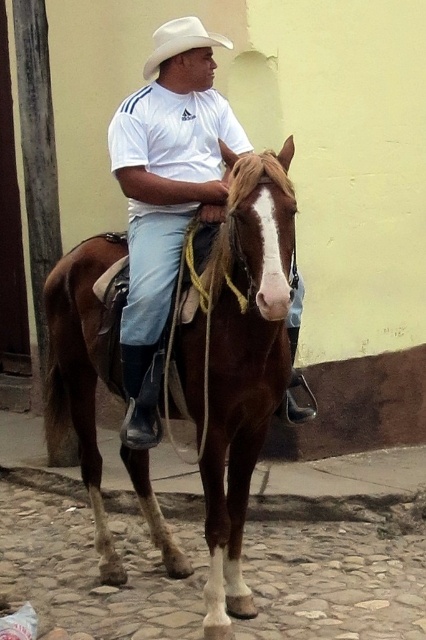
Does brown glossy horse at center have a greater width compared to white matte shirt at center?

Incorrect, brown glossy horse at center's width does not surpass white matte shirt at center's.

You are a GUI agent. You are given a task and a screenshot of the screen. Output one action in this format:
    pyautogui.click(x=<x>, y=<y>)
    Task: Click on the brown glossy horse at center
    
    Given the screenshot: What is the action you would take?
    pyautogui.click(x=238, y=362)

Between point (239, 280) and point (203, 93), which one is positioned behind?

Positioned behind is point (203, 93).

Locate an element on the screen. The height and width of the screenshot is (640, 426). brown glossy horse at center is located at coordinates (238, 362).

Between white matte shirt at center and white matte cowboy hat at upper center, which one is positioned higher?

white matte cowboy hat at upper center is above.

Does point (166, 72) lie in front of point (186, 45)?

That is False.

Where is `white matte shirt at center`? white matte shirt at center is located at coordinates (166, 195).

Image resolution: width=426 pixels, height=640 pixels. Describe the element at coordinates (238, 362) in the screenshot. I see `brown glossy horse at center` at that location.

Which is in front, point (65, 305) or point (186, 19)?

Point (186, 19) is more forward.

Is point (236, 353) positioned after point (206, 33)?

No.

This screenshot has width=426, height=640. I want to click on brown glossy horse at center, so pos(238,362).